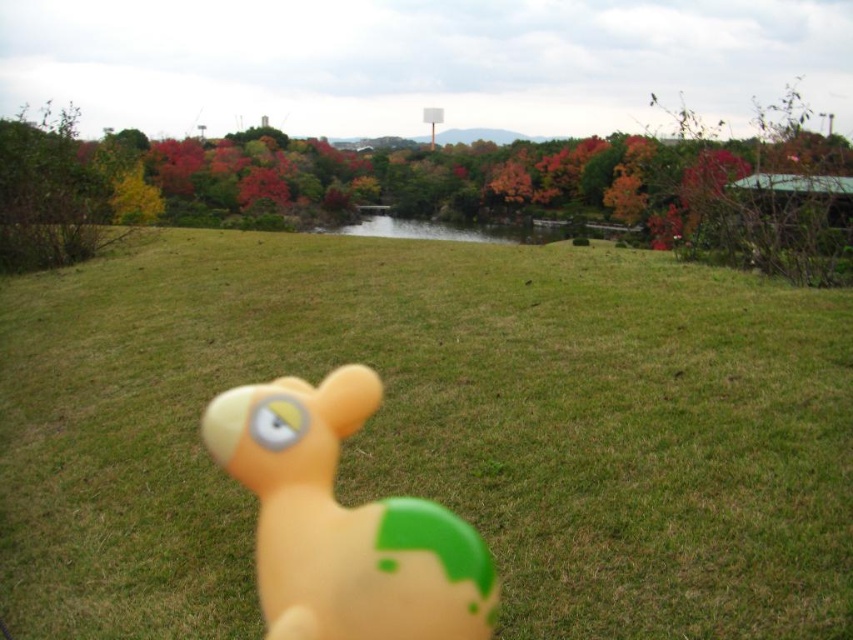
Who is positioned more to the right, green grass at center or rubber duck at center?

rubber duck at center is more to the right.

Locate an element on the screen. This screenshot has height=640, width=853. green grass at center is located at coordinates (434, 429).

Does green grass at center have a larger size compared to green leafy bush at left?

No.

Can you confirm if green grass at center is taller than green leafy bush at left?

No.

The width and height of the screenshot is (853, 640). What are the coordinates of `green grass at center` in the screenshot? It's located at (434, 429).

Between rubber duck at center and green leafy bush at left, which one is positioned lower?

rubber duck at center is lower down.

Consider the image. Between rubber duck at center and green leafy bush at left, which one appears on the left side from the viewer's perspective?

Positioned to the left is green leafy bush at left.

Between point (254, 440) and point (68, 154), which one is positioned in front?

Positioned in front is point (254, 440).

Locate an element on the screen. Image resolution: width=853 pixels, height=640 pixels. rubber duck at center is located at coordinates (343, 522).